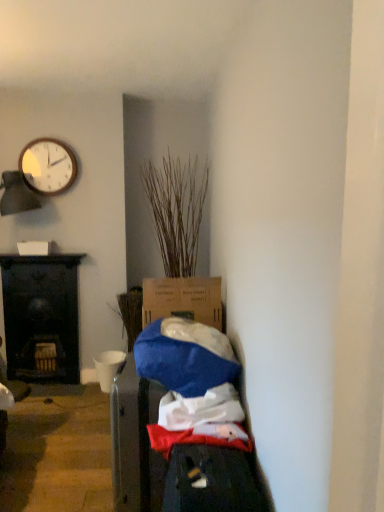
Consider the image. In order to face matte white clock at upper left, should I rotate leftwards or rightwards?

It's best to rotate left around 18.790 degrees.

Find the location of a particular element. dry grass at center is located at coordinates (176, 211).

Is matte white clock at upper left to the right of dry grass at center from the viewer's perspective?

No.

Is matte white clock at upper left oriented towards dry grass at center?

No, matte white clock at upper left is not aimed at dry grass at center.

From their relative heights in the image, would you say matte white clock at upper left is taller or shorter than dry grass at center?

Considering their sizes, matte white clock at upper left has less height than dry grass at center.

Based on the photo, how many degrees apart are the facing directions of matte white clock at upper left and dry grass at center?

The angular difference between matte white clock at upper left and dry grass at center is 0.425 degrees.

From the image's perspective, which one is positioned higher, black wood desk at left or matte white clock at upper left?

From the image's view, matte white clock at upper left is above.

Does black wood desk at left touch matte white clock at upper left?

They are not placed beside each other.

Which of these two, black wood desk at left or matte white clock at upper left, is thinner?

With smaller width is matte white clock at upper left.

Is black wood desk at left oriented towards matte white clock at upper left?

No, black wood desk at left is not oriented towards matte white clock at upper left.

Does dry grass at center appear on the right side of matte white clock at upper left?

Yes, dry grass at center is to the right of matte white clock at upper left.

From the image's perspective, is dry grass at center above matte white clock at upper left?

No.

Considering the relative sizes of dry grass at center and matte white clock at upper left in the image provided, is dry grass at center smaller than matte white clock at upper left?

No, dry grass at center is not smaller than matte white clock at upper left.

Which object is further away from the camera taking this photo, dry grass at center or matte white clock at upper left?

matte white clock at upper left is further from the camera.

Considering the relative positions of dry grass at center and black wood desk at left in the image provided, is dry grass at center to the left or to the right of black wood desk at left?

Clearly, dry grass at center is on the right of black wood desk at left in the image.

Are dry grass at center and black wood desk at left far apart?

Yes, dry grass at center and black wood desk at left are located far from each other.

Does dry grass at center turn towards black wood desk at left?

No, dry grass at center is not turned towards black wood desk at left.

From the picture: Which is more distant, (193, 214) or (31, 380)?

Point (31, 380)

Are black wood desk at left and dry grass at center making contact?

black wood desk at left and dry grass at center are not in contact.

Which object is positioned more to the left, black wood desk at left or dry grass at center?

Positioned to the left is black wood desk at left.

Which is less distant, (x=25, y=265) or (x=181, y=239)?

Point (x=25, y=265) is positioned farther from the camera compared to point (x=181, y=239).

Identify the location of desk behind the dry grass at center. (41, 315).

From the picture: Is matte white clock at upper left spatially inside black wood desk at left, or outside of it?

matte white clock at upper left is outside black wood desk at left.

The width and height of the screenshot is (384, 512). I want to click on desk below the matte white clock at upper left (from a real-world perspective), so click(41, 315).

From the image's perspective, who appears lower, matte white clock at upper left or black wood desk at left?

black wood desk at left.

Between point (22, 151) and point (42, 309), which one is positioned behind?

Point (42, 309)

What are the coordinates of `plant below the matte white clock at upper left (from the image's perspective)` in the screenshot? It's located at (176, 211).

Image resolution: width=384 pixels, height=512 pixels. Identify the location of desk below the matte white clock at upper left (from a real-world perspective). (41, 315).

From the image, which object appears to be farther from matte white clock at upper left, dry grass at center or black wood desk at left?

The object further to matte white clock at upper left is black wood desk at left.

From the image, which object appears to be nearer to matte white clock at upper left, black wood desk at left or dry grass at center?

dry grass at center lies closer to matte white clock at upper left than the other object.

Estimate the real-world distances between objects in this image. Which object is further from black wood desk at left, dry grass at center or matte white clock at upper left?

dry grass at center is further to black wood desk at left.

Estimate the real-world distances between objects in this image. Which object is further from dry grass at center, matte white clock at upper left or black wood desk at left?

Based on the image, black wood desk at left appears to be further to dry grass at center.

Looking at the image, which one is located closer to black wood desk at left, matte white clock at upper left or dry grass at center?

matte white clock at upper left lies closer to black wood desk at left than the other object.

Considering their positions, is black wood desk at left positioned further to dry grass at center than matte white clock at upper left?

black wood desk at left lies further to dry grass at center than the other object.

Where is `plant between matte white clock at upper left and black wood desk at left vertically`? The height and width of the screenshot is (512, 384). plant between matte white clock at upper left and black wood desk at left vertically is located at coordinates (176, 211).